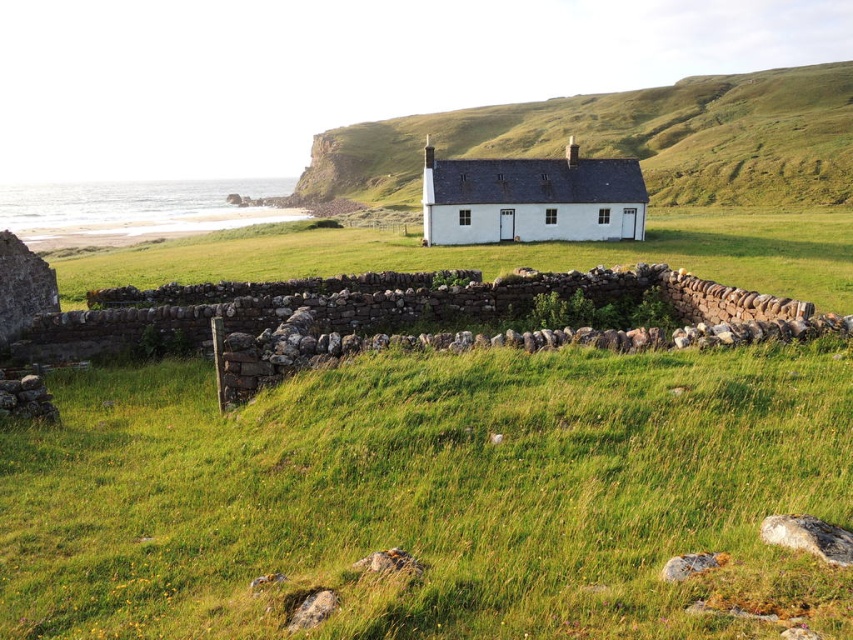
Consider the image. Which is more to the left, green grassy at center or green grassy field at center?

From the viewer's perspective, green grassy at center appears more on the left side.

Is point (688, 593) less distant than point (144, 262)?

That is True.

Locate an element on the screen. green grassy at center is located at coordinates (428, 493).

Does green grassy at center have a smaller size compared to white painted wood cottage at center?

Indeed, green grassy at center has a smaller size compared to white painted wood cottage at center.

Is the position of green grassy at center more distant than that of white painted wood cottage at center?

No, green grassy at center is closer to the viewer.

Is point (259, 621) closer to viewer compared to point (447, 177)?

Yes, it is.

Find the location of `green grassy at center`. green grassy at center is located at coordinates (428, 493).

Is green grassy at center positioned in front of green grassy hillside at center?

Yes, it is.

Can you confirm if green grassy at center is positioned above green grassy hillside at center?

No.

Which is behind, point (247, 634) or point (534, 140)?

Point (534, 140)

This screenshot has height=640, width=853. I want to click on green grassy at center, so click(x=428, y=493).